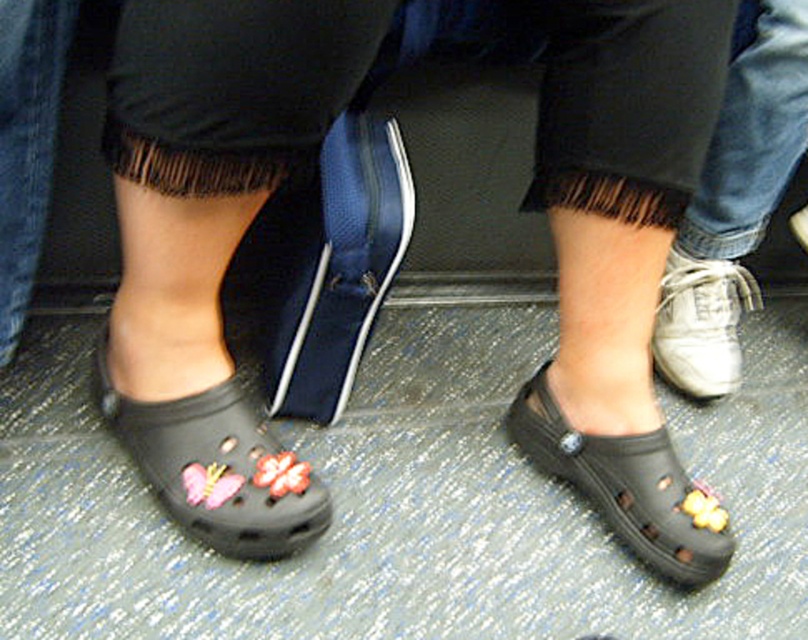
You are standing on a train and see your white leather shoe at lower right and the black Crocs with butterfly decorations. How far apart are they?

The white leather shoe at lower right and the black Crocs with butterfly decorations are 37.17 inches apart.

You are on a crowded train and need to make space for your bag. There are two items in your way. Which one is closer to the right side, the white leather shoe at lower right or the black rubber clog at lower center?

The white leather shoe at lower right is to the right of the black rubber clog at lower center, so it is closer to the right side.

You are a passenger on a train and you see the white leather shoe at lower right and the black rubber clog at lower center. Which one is closer to you?

The white leather shoe at lower right is closer to you because the black rubber clog at lower center is behind it.